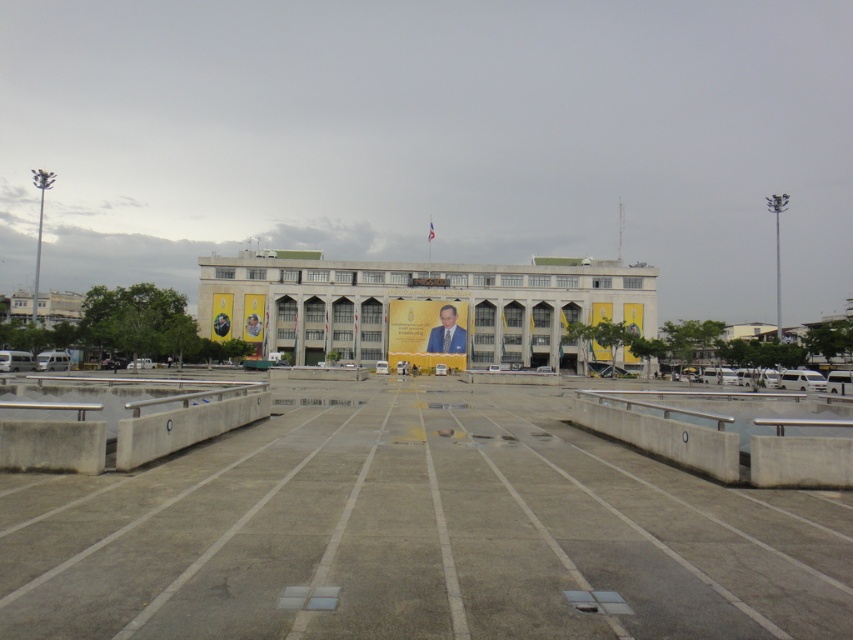
Question: Is concrete at center to the right of formal suit at center from the viewer's perspective?

Choices:
 (A) no
 (B) yes

Answer: (A)

Question: Can you confirm if yellow wall at center is positioned to the left of formal suit at center?

Choices:
 (A) yes
 (B) no

Answer: (A)

Question: Which object appears farthest from the camera in this image?

Choices:
 (A) concrete at center
 (B) formal suit at center

Answer: (B)

Question: Which of these objects is positioned closest to the yellow wall at center?

Choices:
 (A) concrete at center
 (B) formal suit at center

Answer: (B)

Question: Estimate the real-world distances between objects in this image. Which object is closer to the yellow wall at center?

Choices:
 (A) formal suit at center
 (B) concrete at center

Answer: (A)

Question: Is concrete at center to the right of formal suit at center from the viewer's perspective?

Choices:
 (A) no
 (B) yes

Answer: (A)